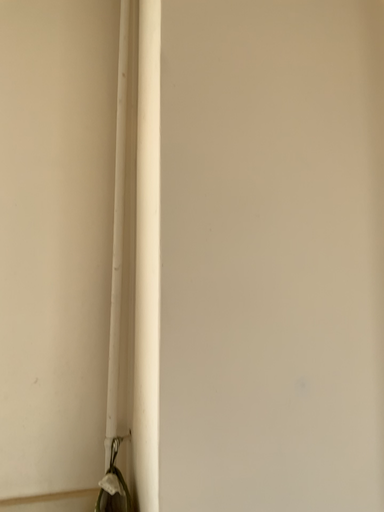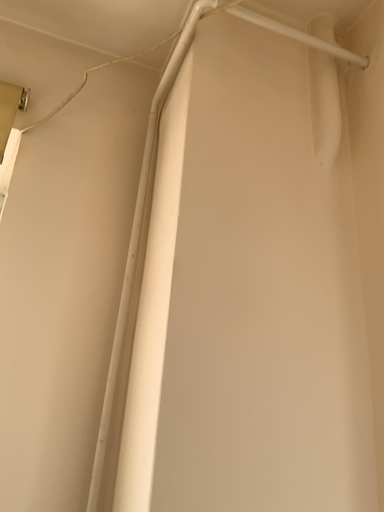
Question: Which way did the camera rotate in the video?

Choices:
 (A) rotated upward
 (B) rotated downward

Answer: (A)